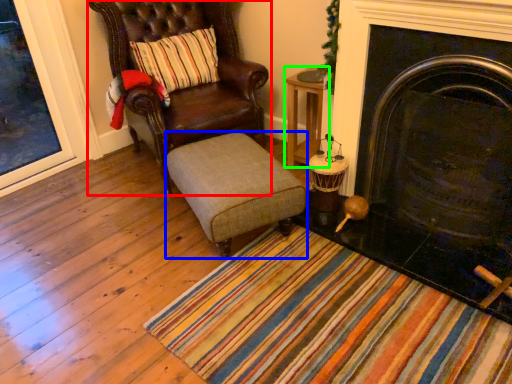
Question: Which is farther away from chair (highlighted by a red box)? stool (highlighted by a blue box) or table (highlighted by a green box)?

Choices:
 (A) stool
 (B) table

Answer: (B)